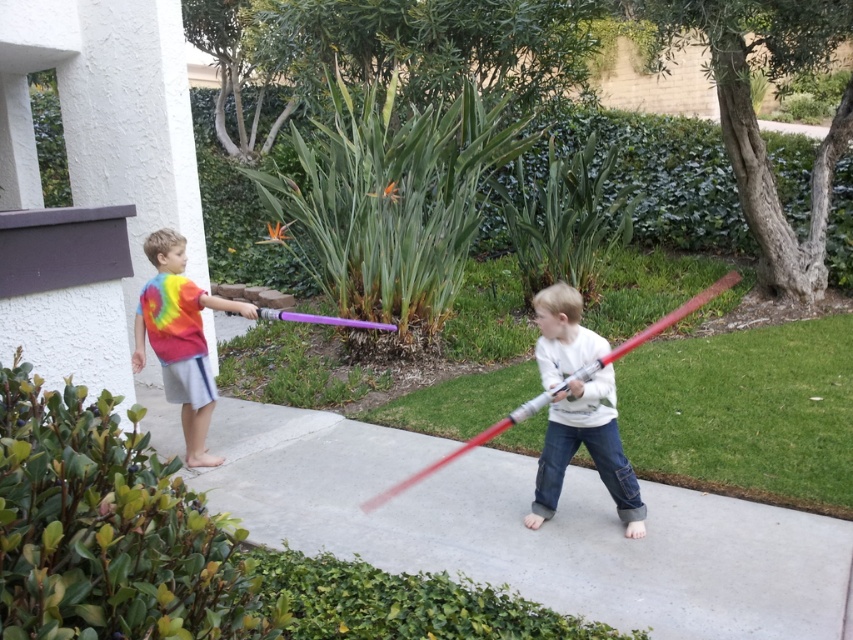
Does smooth concrete sidewalk at center have a larger size compared to rainbow tie-dye shirt at left?

Indeed, smooth concrete sidewalk at center has a larger size compared to rainbow tie-dye shirt at left.

Describe the element at coordinates (531, 531) in the screenshot. Image resolution: width=853 pixels, height=640 pixels. I see `smooth concrete sidewalk at center` at that location.

Locate an element on the screen. The height and width of the screenshot is (640, 853). smooth concrete sidewalk at center is located at coordinates point(531,531).

Is smooth concrete sidewalk at center wider than shiny red plastic bat at center?

Indeed, smooth concrete sidewalk at center has a greater width compared to shiny red plastic bat at center.

Is smooth concrete sidewalk at center taller than shiny red plastic bat at center?

Incorrect, smooth concrete sidewalk at center's height is not larger of shiny red plastic bat at center's.

Where is `smooth concrete sidewalk at center`? Image resolution: width=853 pixels, height=640 pixels. smooth concrete sidewalk at center is located at coordinates (531, 531).

This screenshot has width=853, height=640. Find the location of `smooth concrete sidewalk at center`. smooth concrete sidewalk at center is located at coordinates (531, 531).

Between smooth concrete sidewalk at center and matte white sweater at center, which one appears on the left side from the viewer's perspective?

smooth concrete sidewalk at center is more to the left.

Can you confirm if smooth concrete sidewalk at center is positioned to the left of matte white sweater at center?

Yes, smooth concrete sidewalk at center is to the left of matte white sweater at center.

This screenshot has height=640, width=853. Find the location of `smooth concrete sidewalk at center`. smooth concrete sidewalk at center is located at coordinates (531, 531).